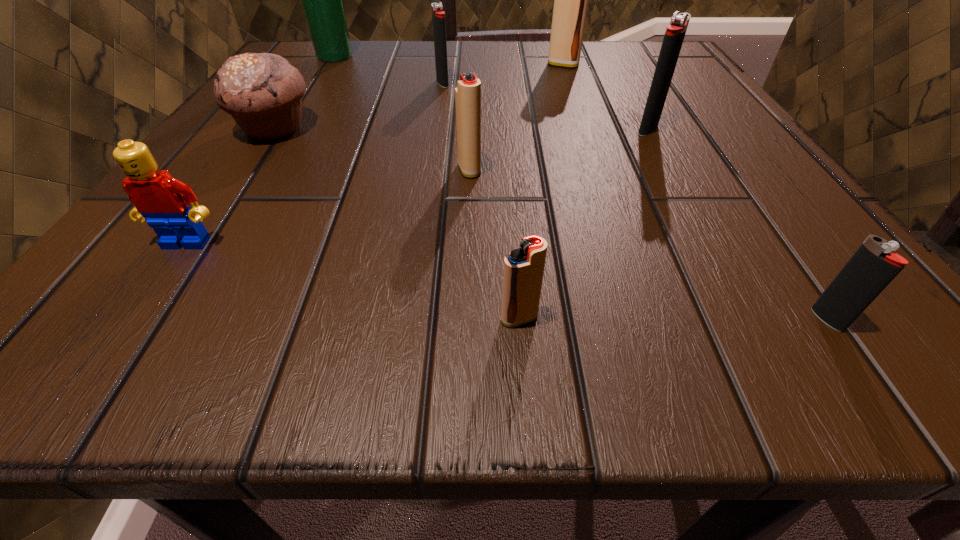
Where is `red igniter that is the third nearest to the red Lego`? The width and height of the screenshot is (960, 540). red igniter that is the third nearest to the red Lego is located at coordinates coord(571,0).

You are a GUI agent. You are given a task and a screenshot of the screen. Output one action in this format:
    pyautogui.click(x=<x>, y=<y>)
    Task: Click on the red igniter that is the third closest to the fourth object from left to right
    The image size is (960, 540).
    Given the screenshot: What is the action you would take?
    pyautogui.click(x=523, y=272)

Locate an element on the screen. black igniter that stands as the closest to the third object from right to left is located at coordinates (438, 15).

Image resolution: width=960 pixels, height=540 pixels. Find the location of `black igniter that is the nearest to the muffin`. black igniter that is the nearest to the muffin is located at coordinates (438, 15).

I want to click on vacant region that satisfies the following two spatial constraints: 1. on the front side of the fourth nearest object; 2. on the left side of the rightmost black igniter, so click(x=465, y=320).

At what (x,y) coordinates should I click in order to perform the action: click on free spot that satisfies the following two spatial constraints: 1. on the back side of the fifth object from left to right; 2. on the right side of the biggest black igniter. Please return your answer as a coordinate pair (x, y). The image size is (960, 540). Looking at the image, I should click on (470, 129).